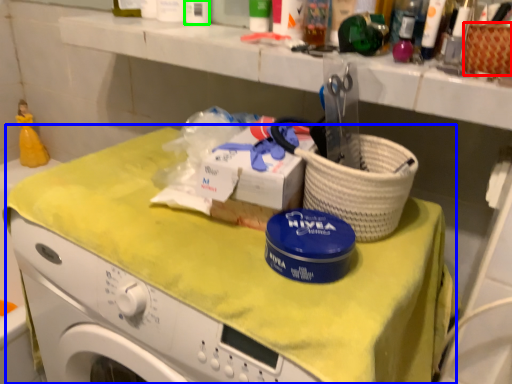
Question: Which is nearer to the basket (highlighted by a red box)? counter (highlighted by a blue box) or toiletry (highlighted by a green box).

Choices:
 (A) counter
 (B) toiletry

Answer: (A)